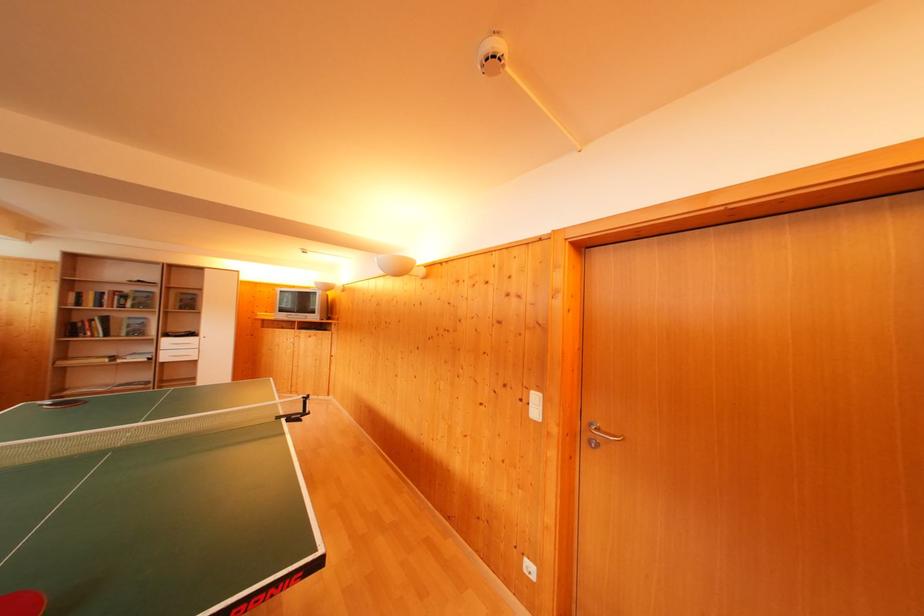
Describe the element at coordinates (601, 434) in the screenshot. This screenshot has height=616, width=924. I see `the silver door handle` at that location.